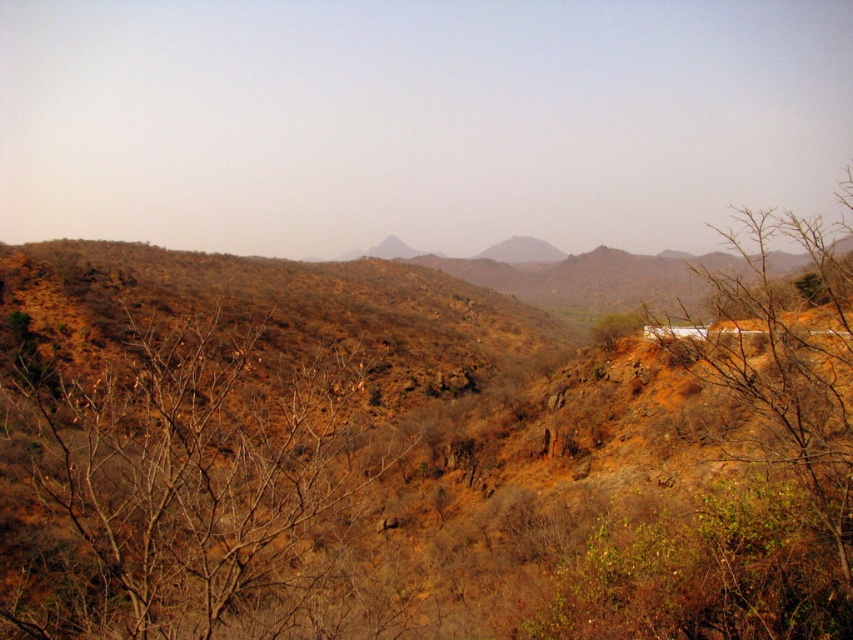
Question: Is brown leafless branches at left behind brown rocky mountain at center?

Choices:
 (A) yes
 (B) no

Answer: (B)

Question: Which point is farther to the camera?

Choices:
 (A) brown leafless branches at left
 (B) brown rocky mountain at center

Answer: (B)

Question: Does brown leafless branches at left lie behind brown rocky mountain at center?

Choices:
 (A) yes
 (B) no

Answer: (B)

Question: Can you confirm if brown leafless branches at left is bigger than brown rocky mountain at center?

Choices:
 (A) no
 (B) yes

Answer: (A)

Question: Which point appears closest to the camera in this image?

Choices:
 (A) (71, 611)
 (B) (692, 256)

Answer: (A)